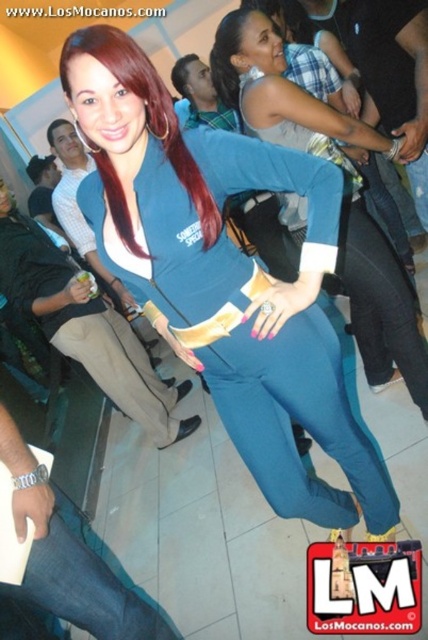
Question: Which object is farther from the camera taking this photo?

Choices:
 (A) blue fabric pants at center
 (B) dark brown hair at upper center
 (C) shiny red hair at center

Answer: (B)

Question: Which point is closer to the camera?

Choices:
 (A) matte blue jumpsuit at center
 (B) dark brown silky hair at upper left
 (C) dark brown hair at upper center
 (D) shiny red hair at center

Answer: (D)

Question: Can you confirm if dark brown silky hair at upper left is positioned to the left of brown shiny hair at upper left?

Choices:
 (A) yes
 (B) no

Answer: (A)

Question: Which point is farther from the camera taking this photo?

Choices:
 (A) (237, 13)
 (B) (184, 64)
 (C) (112, 193)

Answer: (B)

Question: Does matte blue jumpsuit at center have a larger size compared to brown shiny hair at upper left?

Choices:
 (A) yes
 (B) no

Answer: (A)

Question: Is shiny red hair at center to the left of brown shiny hair at upper left from the viewer's perspective?

Choices:
 (A) no
 (B) yes

Answer: (A)